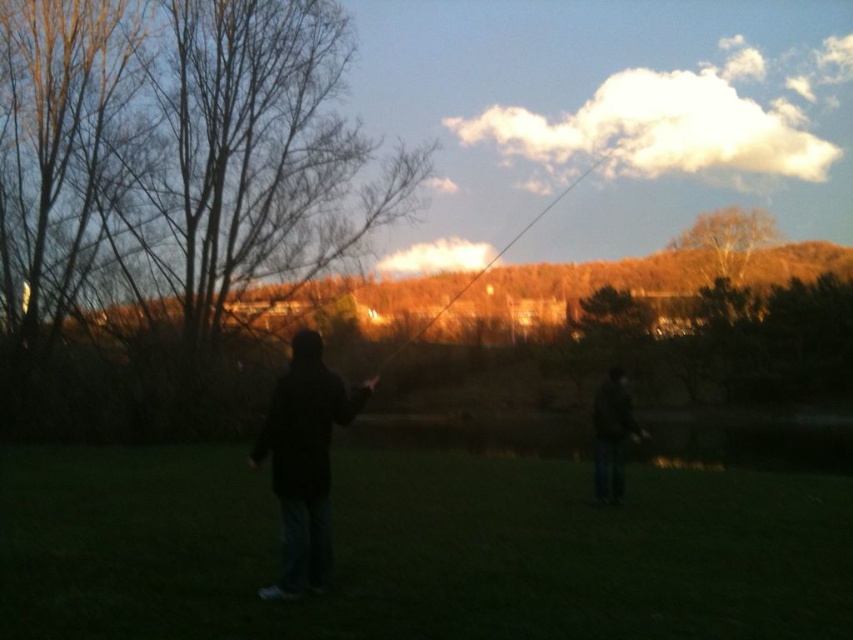
Question: Does black matte jacket at center have a smaller size compared to smooth wooden rod at upper center?

Choices:
 (A) no
 (B) yes

Answer: (B)

Question: Which of the following is the closest to the observer?

Choices:
 (A) (409, 525)
 (B) (561, 195)

Answer: (A)

Question: Which object is positioned closest to the smooth wooden rod at upper center?

Choices:
 (A) brown leafy tree at upper center
 (B) green grass at center
 (C) dark gray jacket at lower right
 (D) black matte jacket at center

Answer: (B)

Question: Which point is farther to the camera?

Choices:
 (A) smooth wooden rod at upper center
 (B) black matte jacket at center
 (C) dark gray jacket at lower right
 (D) brown leafy tree at upper center

Answer: (D)

Question: Is black matte jacket at center positioned before dark gray jacket at lower right?

Choices:
 (A) no
 (B) yes

Answer: (B)

Question: Is black matte jacket at center thinner than brown leafy tree at upper center?

Choices:
 (A) yes
 (B) no

Answer: (A)